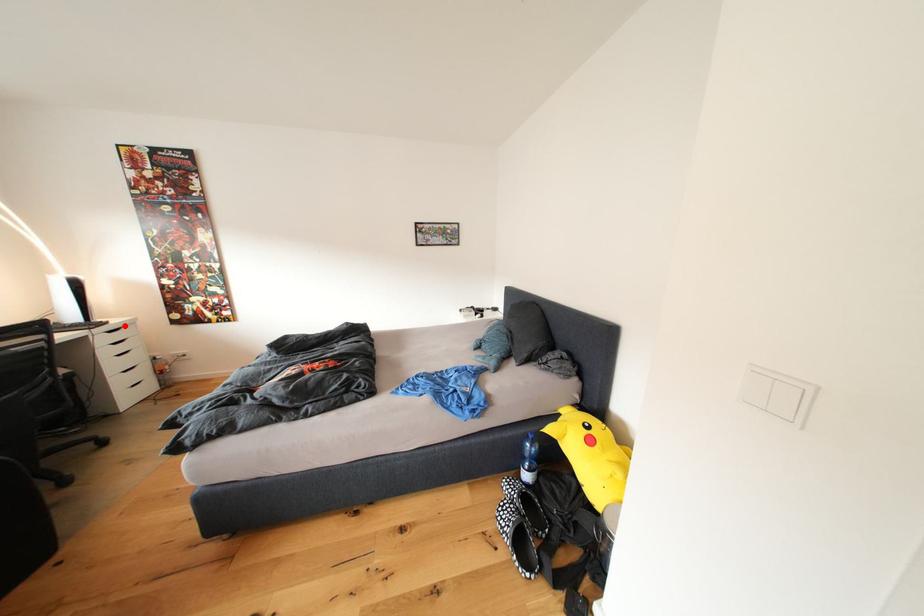
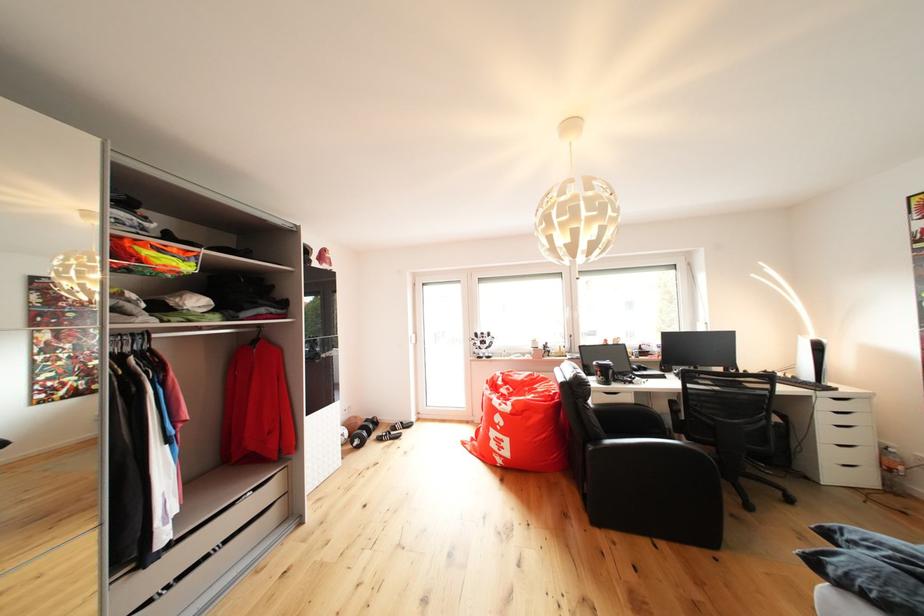
Question: I am providing you with two images of the same scene from different viewpoints. A red point is marked on the first image. Can you still see the location of the red point in image 2?

Choices:
 (A) Yes
 (B) No

Answer: (A)